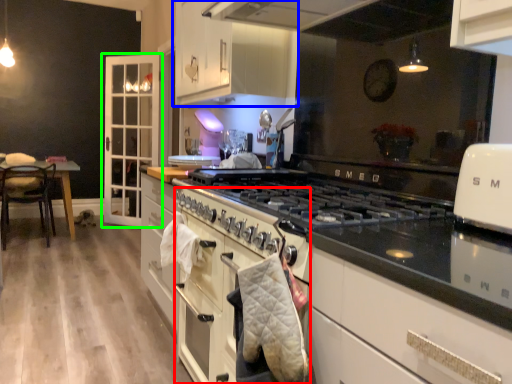
Question: Which object is the closest to the oven (highlighted by a red box)? Choose among these: cabinetry (highlighted by a blue box) or cabinetry (highlighted by a green box).

Choices:
 (A) cabinetry
 (B) cabinetry

Answer: (A)